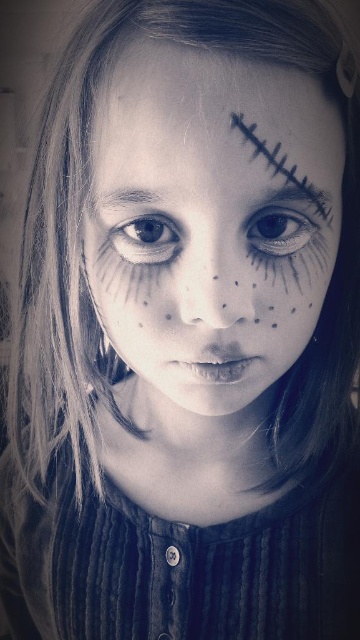
In the black and white portrait, there is a black matte scar at upper center and a gray matte eyebrow at upper left. Which of these two elements has a greater width?

The black matte scar at upper center has a greater width than the gray matte eyebrow at upper left.

From the picture: You are an artist analyzing the portrait. You notice the matte black face paint at center and the brown matte eye at center. Which object is positioned more to the right side of the image?

The matte black face paint at center is positioned more to the right side of the image compared to the brown matte eye at center.